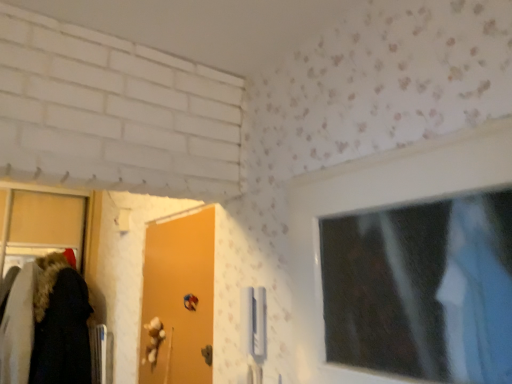
Question: Is metallic blue door handle at lower center closer to camera compared to orange matte door at center?

Choices:
 (A) no
 (B) yes

Answer: (A)

Question: Could you tell me if metallic blue door handle at lower center is facing orange matte door at center?

Choices:
 (A) yes
 (B) no

Answer: (A)

Question: Is metallic blue door handle at lower center smaller than orange matte door at center?

Choices:
 (A) no
 (B) yes

Answer: (B)

Question: Considering the relative positions of metallic blue door handle at lower center and orange matte door at center in the image provided, is metallic blue door handle at lower center to the left of orange matte door at center from the viewer's perspective?

Choices:
 (A) no
 (B) yes

Answer: (A)

Question: Considering the relative positions of metallic blue door handle at lower center and orange matte door at center in the image provided, is metallic blue door handle at lower center to the right of orange matte door at center from the viewer's perspective?

Choices:
 (A) no
 (B) yes

Answer: (B)

Question: Are metallic blue door handle at lower center and orange matte door at center located far from each other?

Choices:
 (A) no
 (B) yes

Answer: (A)

Question: From a real-world perspective, is orange matte door at center over metallic blue door handle at lower center?

Choices:
 (A) no
 (B) yes

Answer: (B)

Question: Does orange matte door at center have a lesser width compared to metallic blue door handle at lower center?

Choices:
 (A) yes
 (B) no

Answer: (B)

Question: From a real-world perspective, is orange matte door at center physically below metallic blue door handle at lower center?

Choices:
 (A) no
 (B) yes

Answer: (A)

Question: Does orange matte door at center have a lesser height compared to metallic blue door handle at lower center?

Choices:
 (A) yes
 (B) no

Answer: (B)

Question: Considering the relative sizes of orange matte door at center and metallic blue door handle at lower center in the image provided, is orange matte door at center taller than metallic blue door handle at lower center?

Choices:
 (A) yes
 (B) no

Answer: (A)

Question: Is orange matte door at center smaller than metallic blue door handle at lower center?

Choices:
 (A) yes
 (B) no

Answer: (B)

Question: From their relative heights in the image, would you say orange matte door at center is taller or shorter than metallic blue door handle at lower center?

Choices:
 (A) short
 (B) tall

Answer: (B)